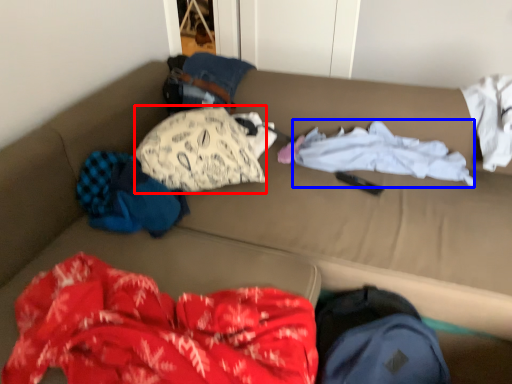
Question: Which object is further to the camera taking this photo, clothing (highlighted by a red box) or clothing (highlighted by a blue box)?

Choices:
 (A) clothing
 (B) clothing

Answer: (B)